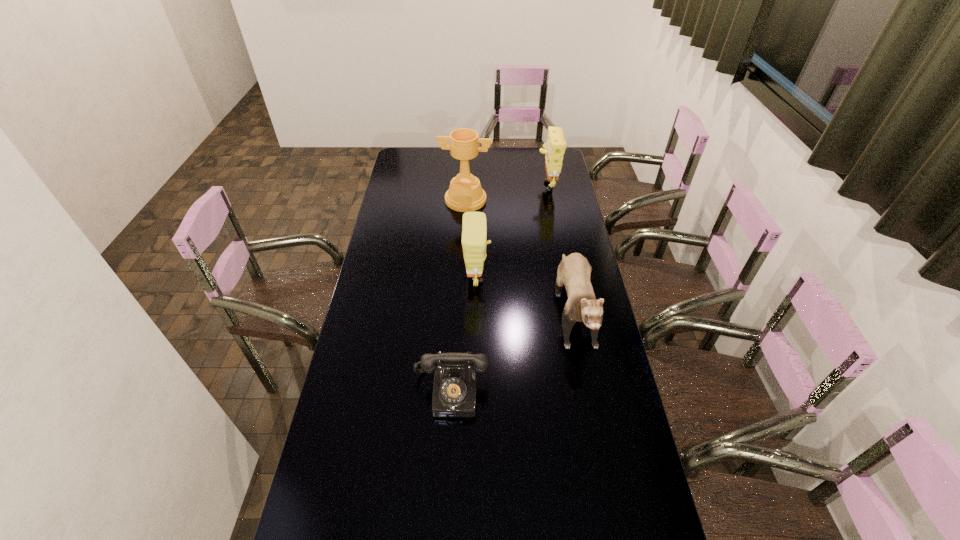
You are a GUI agent. You are given a task and a screenshot of the screen. Output one action in this format:
    pyautogui.click(x=<x>, y=<y>)
    Task: Click on the free spot between the telephone and the ferret
    Image resolution: width=960 pixels, height=540 pixels.
    Given the screenshot: What is the action you would take?
    pyautogui.click(x=512, y=348)

At what (x,y) coordinates should I click in order to perform the action: click on vacant area that lies between the nearer sponge and the ferret. Please return your answer as a coordinate pair (x, y). This screenshot has height=540, width=960. Looking at the image, I should click on (525, 291).

Find the location of `free space between the shortest object and the ferret`. free space between the shortest object and the ferret is located at coordinates (512, 348).

I want to click on vacant area that lies between the shortest object and the award, so click(458, 295).

The height and width of the screenshot is (540, 960). Identify the location of vacant space in between the farther sponge and the award. (506, 192).

The width and height of the screenshot is (960, 540). In order to click on free space between the ferret and the shortest object in this screenshot , I will do `click(512, 348)`.

This screenshot has height=540, width=960. Identify the location of object that is the closest to the tallest object. (554, 149).

Point out which object is positioned as the third nearest to the ferret. Please provide its 2D coordinates. Your answer should be formatted as a tuple, i.e. [(x, y)], where the tuple contains the x and y coordinates of a point satisfying the conditions above.

[(465, 194)]

Where is `free spot that satisfies the following two spatial constraints: 1. on the face of the nearer sponge; 2. on the dial of the shortest object`? The width and height of the screenshot is (960, 540). free spot that satisfies the following two spatial constraints: 1. on the face of the nearer sponge; 2. on the dial of the shortest object is located at coordinates coord(476,391).

The height and width of the screenshot is (540, 960). I want to click on free space that satisfies the following two spatial constraints: 1. on the face of the right sponge; 2. on the dial of the shortest object, so click(586, 391).